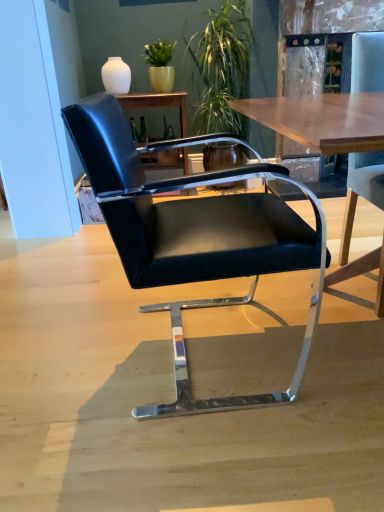
Where is `vacant area situated below black leather chair at center, the 1th chair in the left-to-right sequence (from a real-world perspective)`? The width and height of the screenshot is (384, 512). vacant area situated below black leather chair at center, the 1th chair in the left-to-right sequence (from a real-world perspective) is located at coordinates (224, 347).